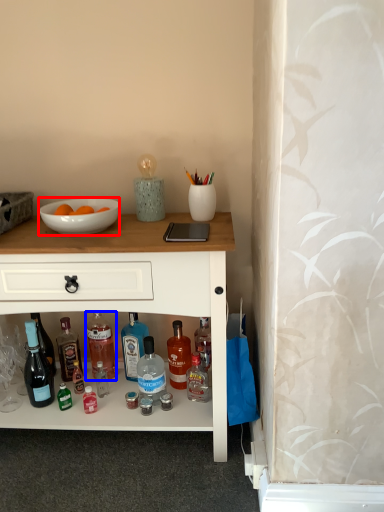
Question: Which object is closer to the camera taking this photo, bowl (highlighted by a red box) or bottle (highlighted by a blue box)?

Choices:
 (A) bowl
 (B) bottle

Answer: (A)